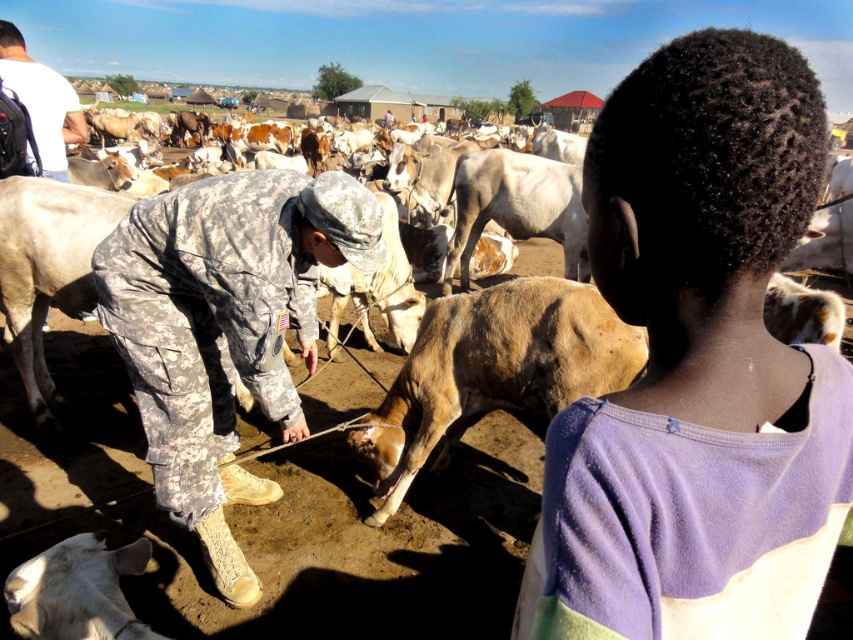
You are a photographer trying to capture a group photo of the purple cotton shirt at upper right and the white matte shirt at upper left. Which shirt should you position closer to the front to ensure both are visible in the photo?

The purple cotton shirt at upper right is not as tall as the white matte shirt at upper left, so you should position the purple cotton shirt at upper right closer to the front to ensure both are visible in the photo.

You are a farmer who needs to identify the largest object in the scene. Which one is it between the brown rough cow at center and the white matte shirt at upper left?

The brown rough cow at center is bigger than the white matte shirt at upper left, so the largest object between them is the brown rough cow at center.

You are a photographer trying to capture both the purple cotton shirt at upper right and the white matte shirt at upper left in the same frame. Based on their sizes in the image, which shirt should you focus on first to ensure both are clearly visible in the photo?

The purple cotton shirt at upper right is smaller in size compared to the white matte shirt at upper left. To ensure both are clearly visible, focus on the smaller purple cotton shirt at upper right first, then adjust the camera to include the larger white matte shirt at upper left in the frame.